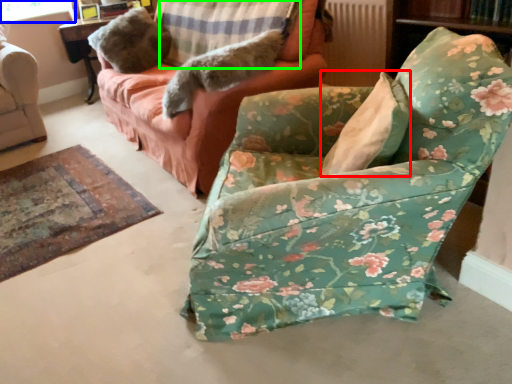
Question: Considering the real-world distances, which object is farthest from pillow (highlighted by a red box)? window screen (highlighted by a blue box) or pillow (highlighted by a green box)?

Choices:
 (A) window screen
 (B) pillow

Answer: (A)